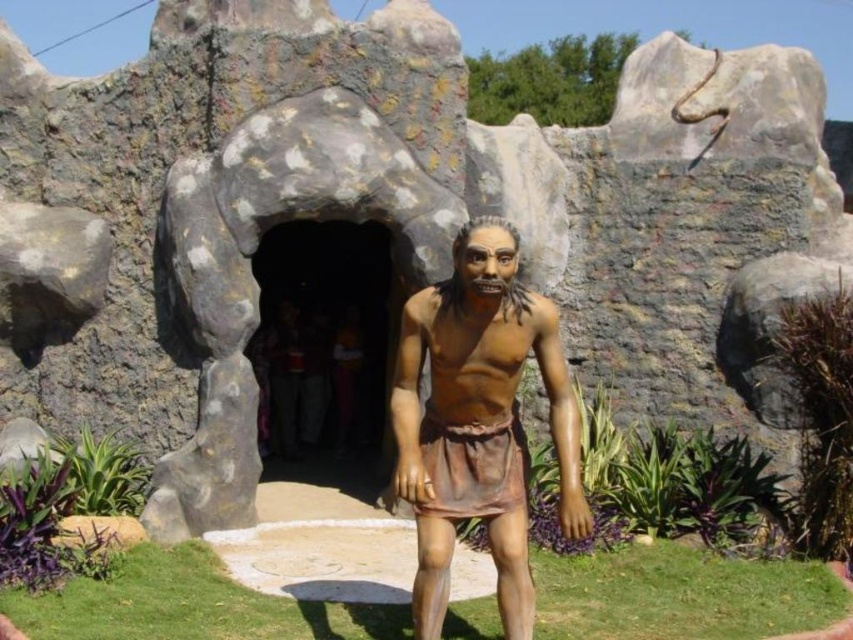
Question: Does brown matte statue at center lie in front of dark stone cave at center?

Choices:
 (A) yes
 (B) no

Answer: (A)

Question: Which of the following is the closest to the observer?

Choices:
 (A) (299, 349)
 (B) (405, 358)

Answer: (B)

Question: Which of the following is the closest to the observer?

Choices:
 (A) (277, 243)
 (B) (448, 560)

Answer: (B)

Question: Which point is closer to the camera?

Choices:
 (A) dark stone cave at center
 (B) brown matte statue at center

Answer: (B)

Question: Observing the image, what is the correct spatial positioning of brown matte statue at center in reference to dark stone cave at center?

Choices:
 (A) below
 (B) above

Answer: (A)

Question: Is brown matte statue at center below dark stone cave at center?

Choices:
 (A) no
 (B) yes

Answer: (B)